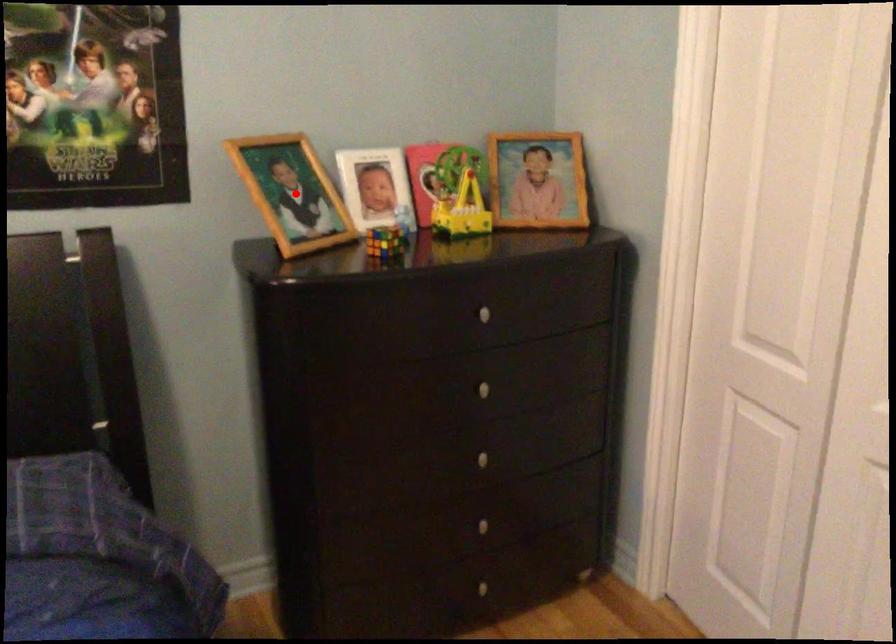
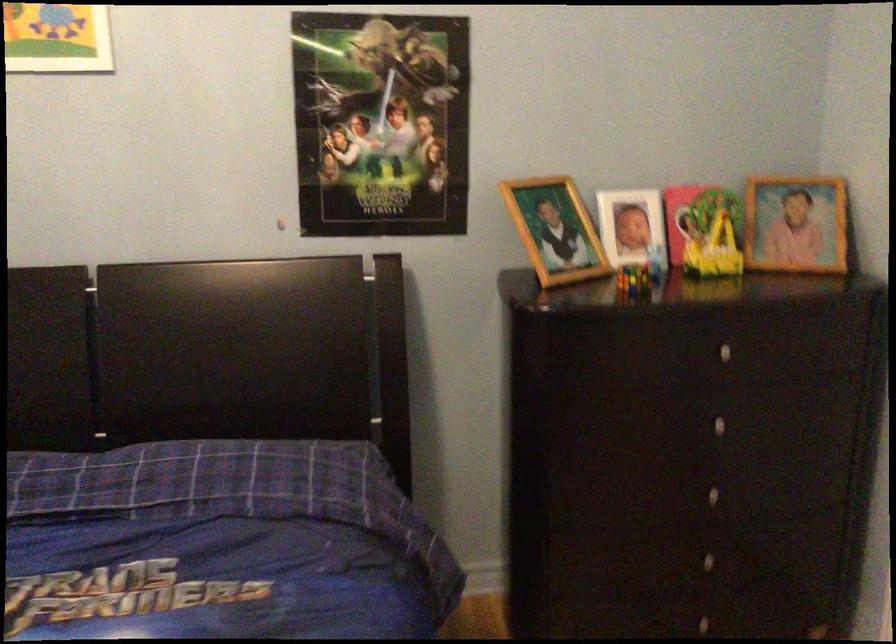
Question: I am providing you with two images of the same scene from different viewpoints. Image1 has a red point marked. In image2, the corresponding 3D location appears at what relative position? Reply with the corresponding letter.

Choices:
 (A) Closer
 (B) Farther

Answer: (B)